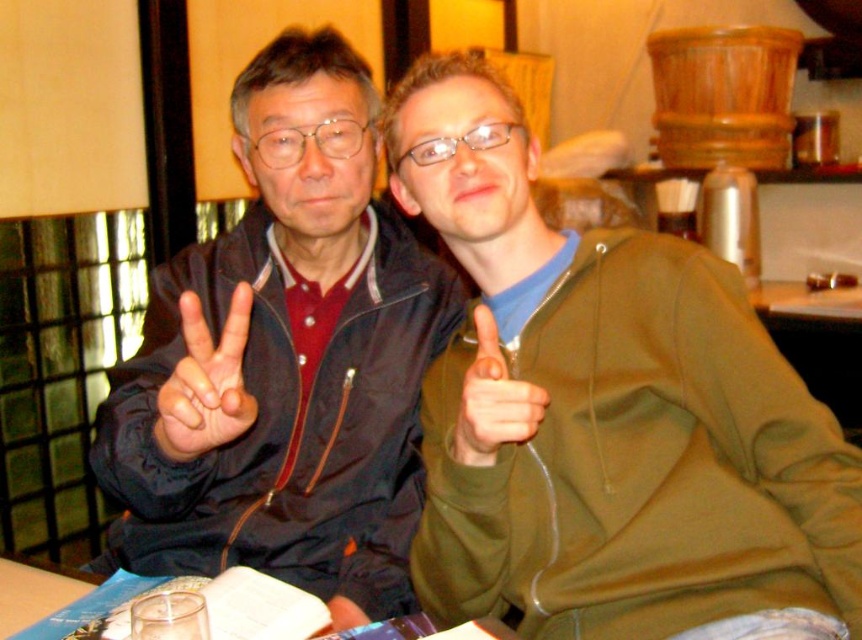
You are a photographer trying to capture a closeup of both the matte black hand at center and the matte green hand at center. Since you want to ensure both hands are clearly visible in the frame, which hand should you adjust your camera focus to prioritize based on their sizes?

The matte black hand at center is larger than the matte green hand at center, so you should prioritize focusing on the matte black hand at center to ensure its details are clear while still capturing the smaller matte green hand at center in the frame.

You are a photographer trying to capture the perfect shot of the matte black hand at center and the matte green hand at center. Since you want to ensure both hands are visible in the frame, which hand should you position closer to the left side of the camera to maintain their arrangement?

You should position the matte black hand at center closer to the left side of the camera because it is already to the left of the matte green hand at center in the scene.

You are a photographer setting up for a group photo. You notice the matte black jacket at left and the matte green hand at center in your frame. Which object is positioned higher in the image?

The matte black jacket at left is positioned higher than the matte green hand at center in the image.